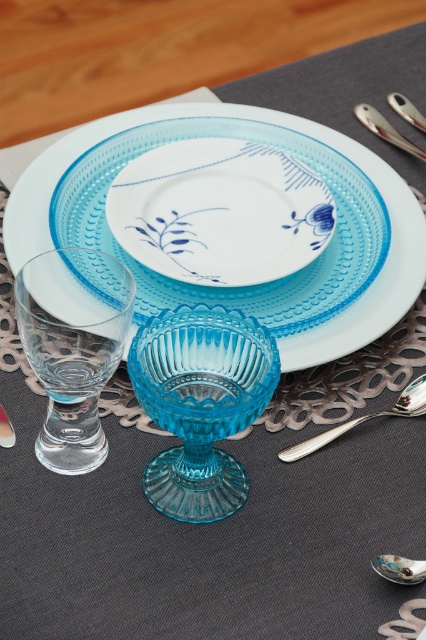
Question: Which object is positioned farthest from the silver metallic spoon at lower right?

Choices:
 (A) silver metallic spoon at upper right
 (B) transparent glass bowl at center

Answer: (A)

Question: Does transparent glass platter at center have a lesser width compared to silver metallic spoon at upper right?

Choices:
 (A) yes
 (B) no

Answer: (B)

Question: Does blue porcelain plate at center appear on the right side of transparent glass bowl at center?

Choices:
 (A) no
 (B) yes

Answer: (B)

Question: Which point is farther to the camera?

Choices:
 (A) silver metallic spoon at lower right
 (B) transparent glass wine glass at lower left
 (C) silver metallic spoon at upper right

Answer: (A)

Question: Which object appears farthest from the camera in this image?

Choices:
 (A) silver metallic spoon at upper right
 (B) silver metallic spoon at lower right
 (C) transparent glass bowl at center
 (D) blue porcelain plate at center

Answer: (D)

Question: Can you confirm if blue porcelain plate at center is bigger than silver metallic spoon at lower right?

Choices:
 (A) no
 (B) yes

Answer: (B)